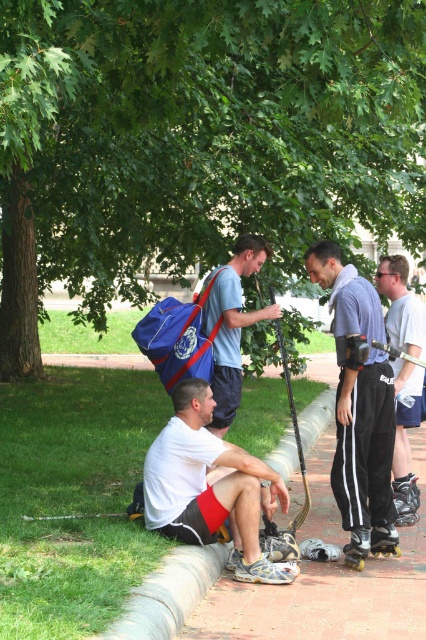
Question: Can you confirm if green leafy tree at upper center is positioned below black roller skates at center?

Choices:
 (A) yes
 (B) no

Answer: (B)

Question: Estimate the real-world distances between objects in this image. Which object is closer to the green leafy tree at upper center?

Choices:
 (A) yellow plastic roller skate at lower right
 (B) matte blue backpack at center

Answer: (B)

Question: Among these objects, which one is farthest from the camera?

Choices:
 (A) matte gray pants at right
 (B) black matte roller skate at lower right
 (C) white matte shorts at lower left
 (D) brick pavement at lower center

Answer: (A)

Question: Can you confirm if brick pavement at lower center is positioned below black matte roller skate at lower right?

Choices:
 (A) no
 (B) yes

Answer: (B)

Question: Can you confirm if green leafy tree at upper center is positioned below matte blue backpack at center?

Choices:
 (A) yes
 (B) no

Answer: (B)

Question: Among these points, which one is farthest from the camera?

Choices:
 (A) (391, 333)
 (B) (377, 548)

Answer: (A)